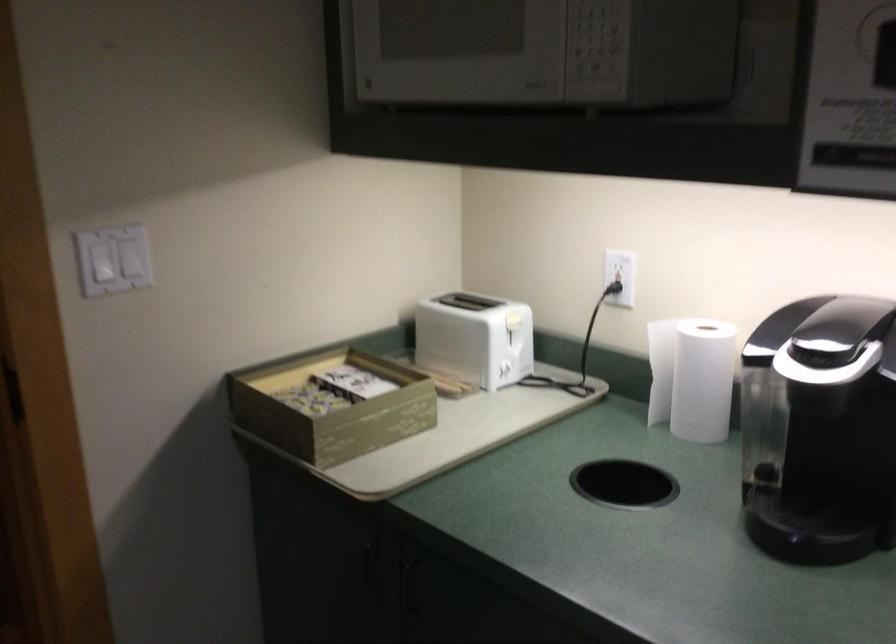
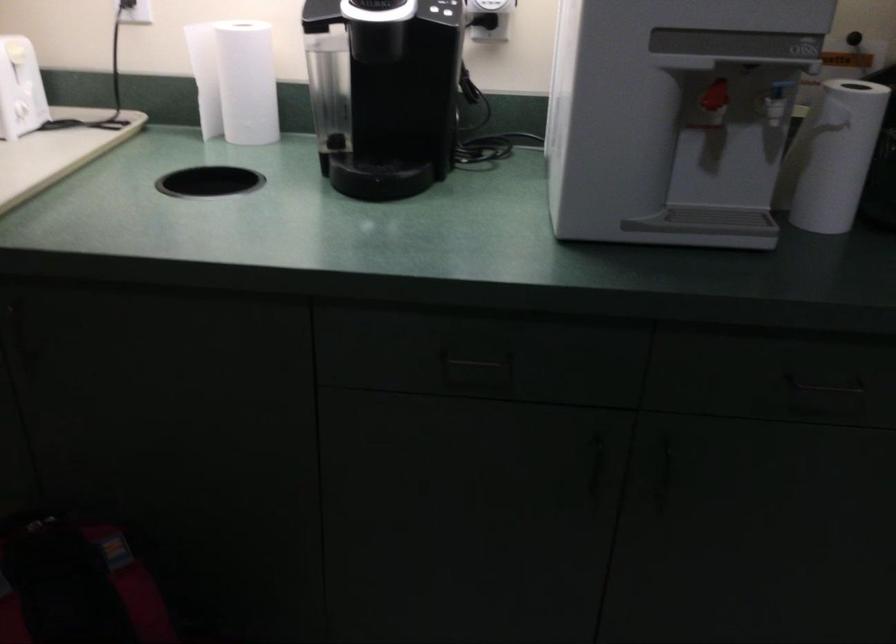
The first image is from the beginning of the video and the second image is from the end. How did the camera likely rotate when shooting the video?

The camera's rotation is toward right-down.